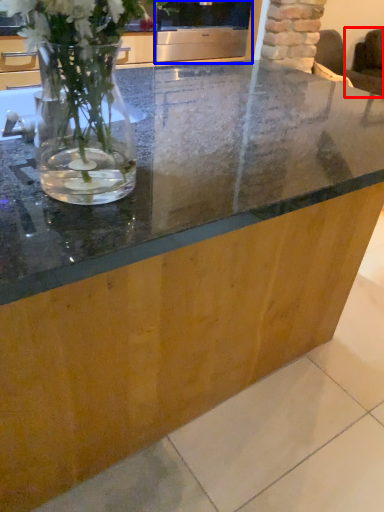
Question: Which point is further to the camera, armchair (highlighted by a red box) or appliance (highlighted by a blue box)?

Choices:
 (A) armchair
 (B) appliance

Answer: (A)